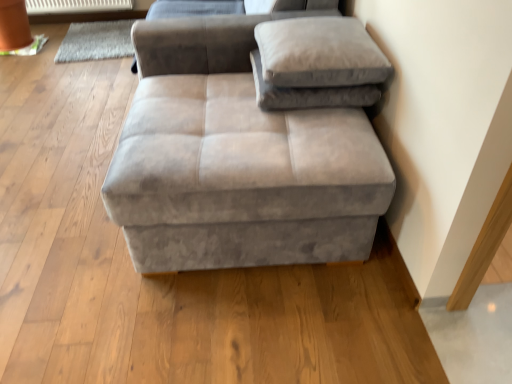
Question: Is white plastic radiator at upper left spatially inside gray woolen mat at upper left, or outside of it?

Choices:
 (A) inside
 (B) outside

Answer: (B)

Question: Would you say white plastic radiator at upper left is to the left or to the right of gray woolen mat at upper left in the picture?

Choices:
 (A) left
 (B) right

Answer: (A)

Question: Which object is the closest to the suede gray ottoman at center?

Choices:
 (A) suede gray pillow at upper right, which is the 2th pillow in top-to-bottom order
 (B) white plastic radiator at upper left
 (C) suede-like beige pillow at upper right, which appears as the 2th pillow when ordered from the bottom
 (D) gray woolen mat at upper left

Answer: (A)

Question: Considering the real-world distances, which object is closest to the white plastic radiator at upper left?

Choices:
 (A) gray woolen mat at upper left
 (B) suede gray pillow at upper right, placed as the first pillow when sorted from bottom to top
 (C) suede gray ottoman at center
 (D) suede-like beige pillow at upper right, the first pillow when ordered from top to bottom

Answer: (A)